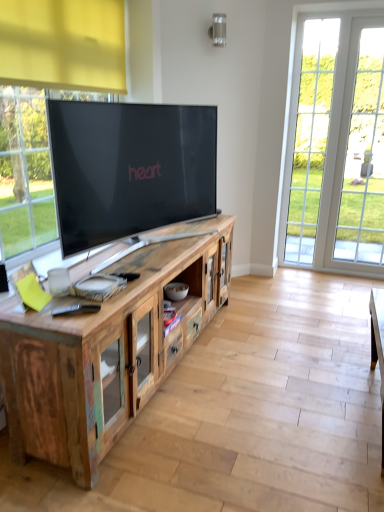
Question: Considering the positions of point (203, 324) and point (302, 164), is point (203, 324) closer or farther from the camera than point (302, 164)?

Choices:
 (A) farther
 (B) closer

Answer: (B)

Question: Would you say rustic wood cabinet at center is inside or outside white glass door at right?

Choices:
 (A) outside
 (B) inside

Answer: (A)

Question: Considering the positions of rustic wood cabinet at center and white glass door at right in the image, is rustic wood cabinet at center wider or thinner than white glass door at right?

Choices:
 (A) wide
 (B) thin

Answer: (A)

Question: In terms of width, does white glass door at right look wider or thinner when compared to rustic wood cabinet at center?

Choices:
 (A) thin
 (B) wide

Answer: (A)

Question: In terms of height, does white glass door at right look taller or shorter compared to rustic wood cabinet at center?

Choices:
 (A) tall
 (B) short

Answer: (A)

Question: Does point (345, 71) appear closer or farther from the camera than point (6, 338)?

Choices:
 (A) farther
 (B) closer

Answer: (A)

Question: Is white glass door at right in front of or behind rustic wood cabinet at center in the image?

Choices:
 (A) behind
 (B) front

Answer: (A)